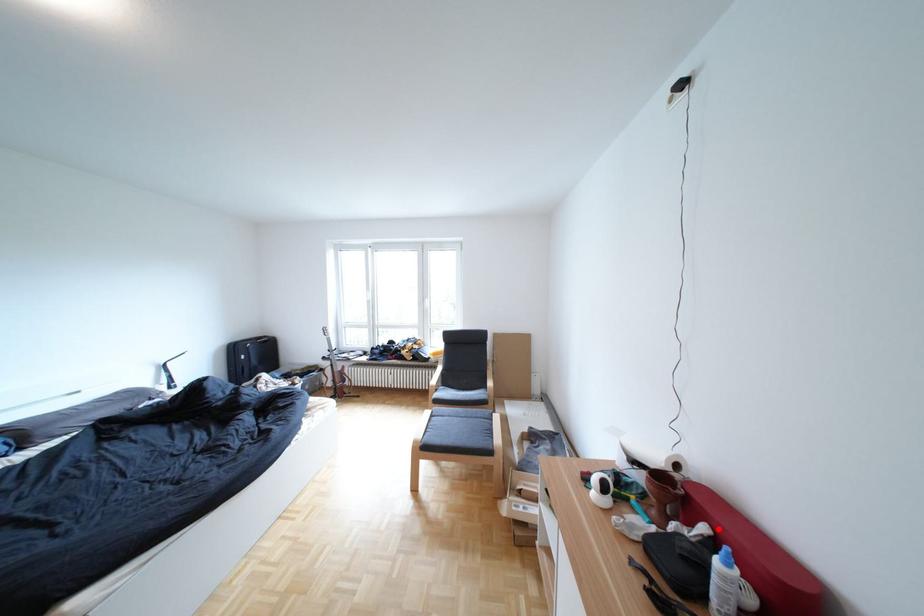
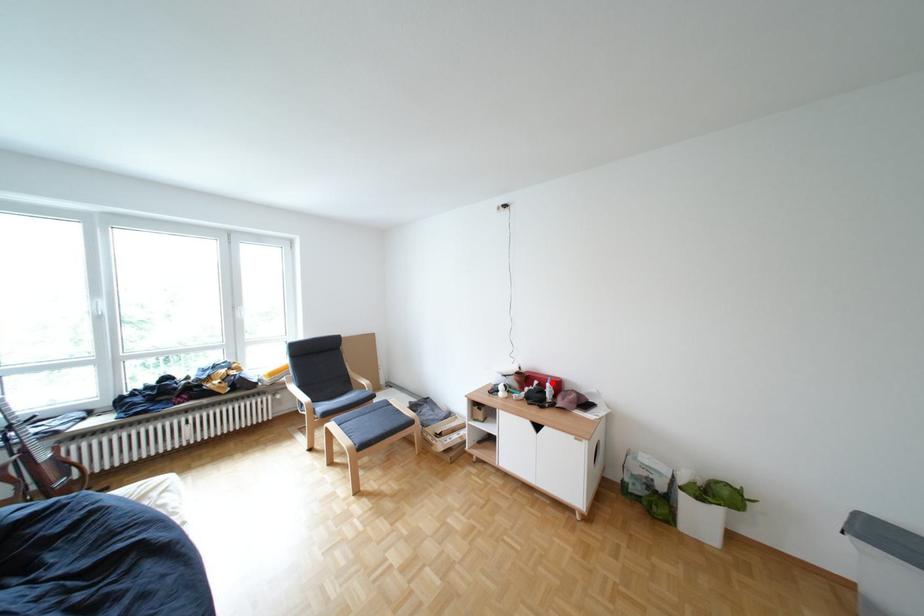
I am providing you with two images of the same scene from different viewpoints. A red point is marked on the first image and another point is marked on the second image. Does the point marked in image1 correspond to the same location as the one in image2?

Yes